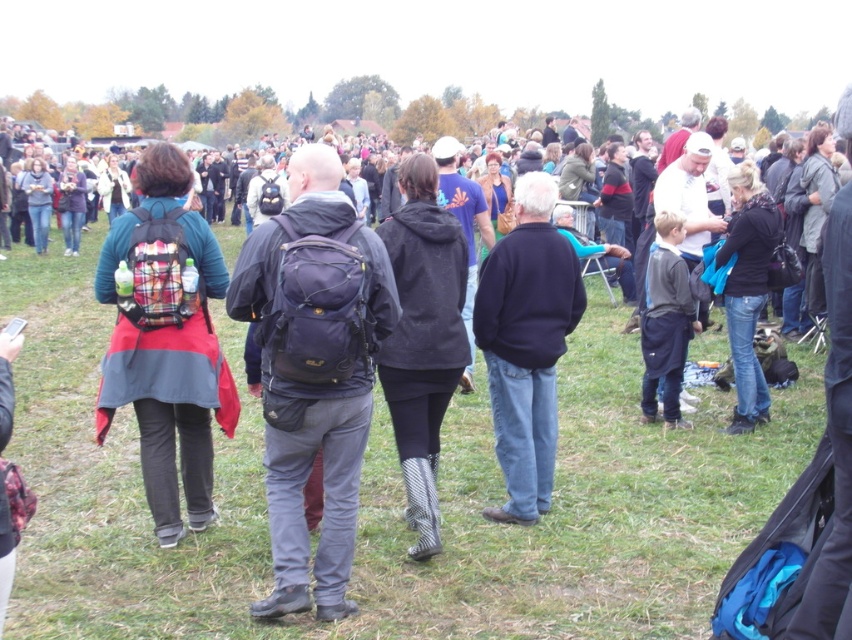
Question: Estimate the real-world distances between objects in this image. Which object is farther from the matte black backpack at center?

Choices:
 (A) dark blue sweater at center
 (B) black textured boots at center

Answer: (A)

Question: Estimate the real-world distances between objects in this image. Which object is closer to the matte black backpack at center?

Choices:
 (A) dark blue sweater at center
 (B) plaid fabric backpack at left
 (C) black matte jacket at center-right

Answer: (B)

Question: Where is black matte jacket at center-right located in relation to dark gray fabric jacket at center-right in the image?

Choices:
 (A) below
 (B) above

Answer: (B)

Question: Is dark blue sweater at center below dark gray fabric jacket at center-right?

Choices:
 (A) yes
 (B) no

Answer: (A)

Question: Which point is farther to the camera?

Choices:
 (A) dark blue sweater at center
 (B) plaid fabric backpack at left
 (C) green grass at center
 (D) black textured boots at center

Answer: (A)

Question: Is green grass at center above matte black backpack at center?

Choices:
 (A) no
 (B) yes

Answer: (A)